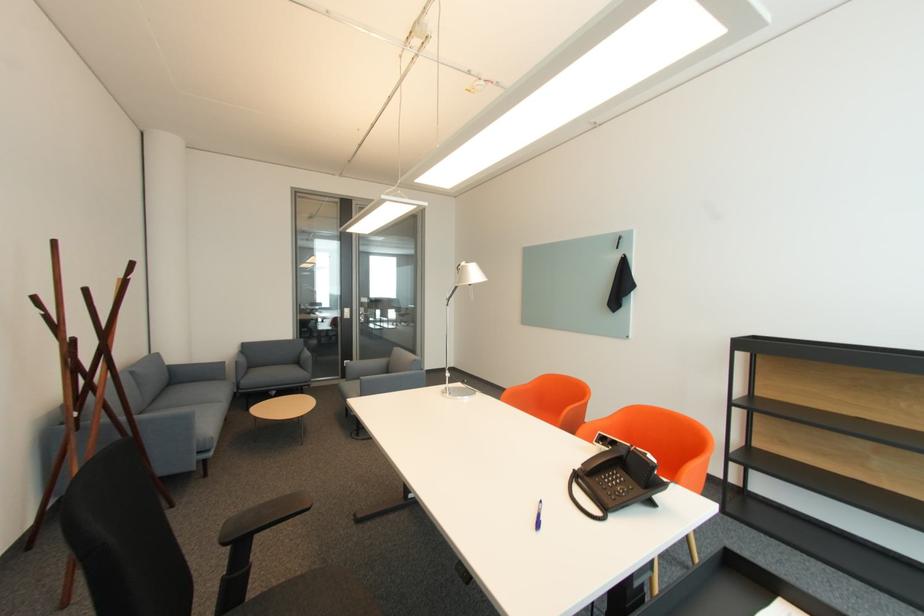
The height and width of the screenshot is (616, 924). I want to click on sofa armrest, so (x=167, y=426).